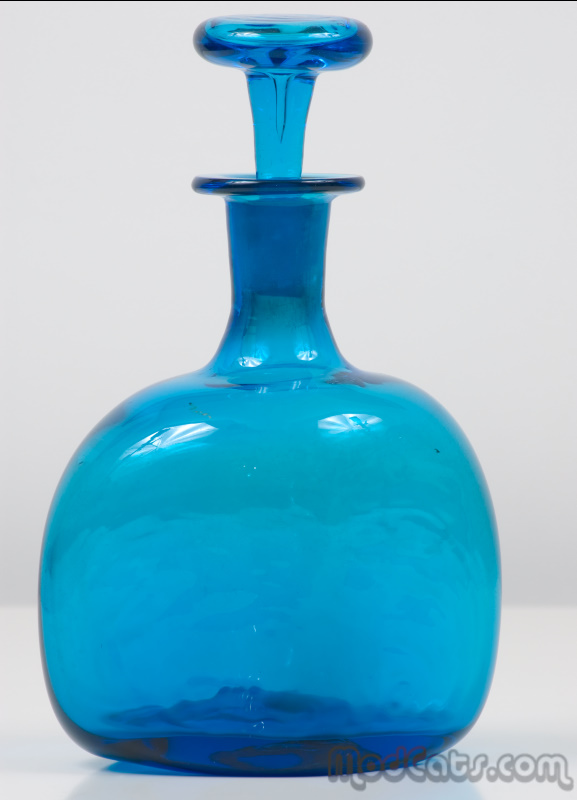
Where is `blue bottle`? This screenshot has width=577, height=800. blue bottle is located at coordinates (391, 694).